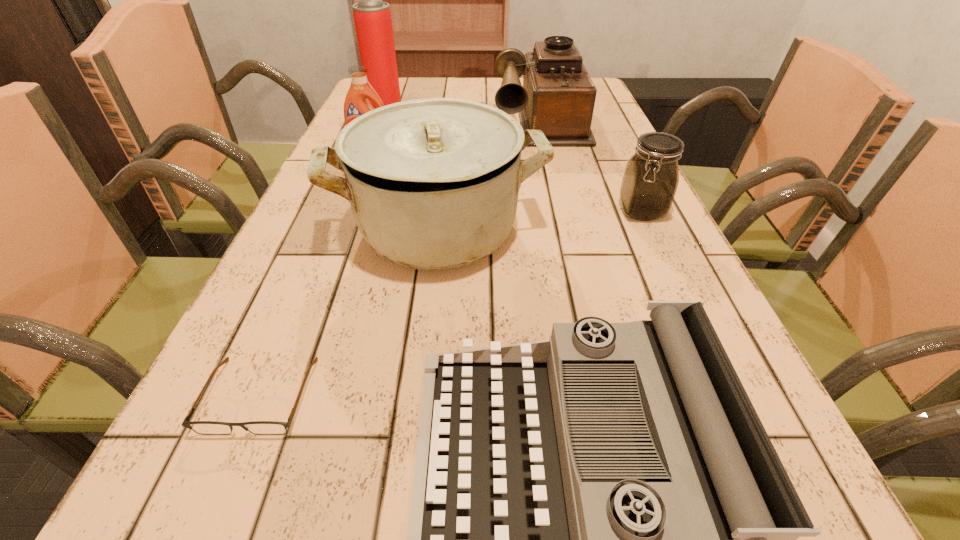
Find the location of a particular element. The image size is (960, 540). object that is the fourth closest to the saucepan is located at coordinates (649, 184).

Locate an element on the screen. This screenshot has width=960, height=540. vacant region that satisfies the following two spatial constraints: 1. on the front-facing side of the detergent; 2. on the left side of the saucepan is located at coordinates click(x=342, y=228).

Find the location of a particular element. This screenshot has height=540, width=960. vacant area that satisfies the following two spatial constraints: 1. on the front-facing side of the detergent; 2. on the left side of the saucepan is located at coordinates (342, 228).

The height and width of the screenshot is (540, 960). I want to click on vacant area that satisfies the following two spatial constraints: 1. on the front side of the saucepan; 2. on the right side of the tallest object, so [x=340, y=228].